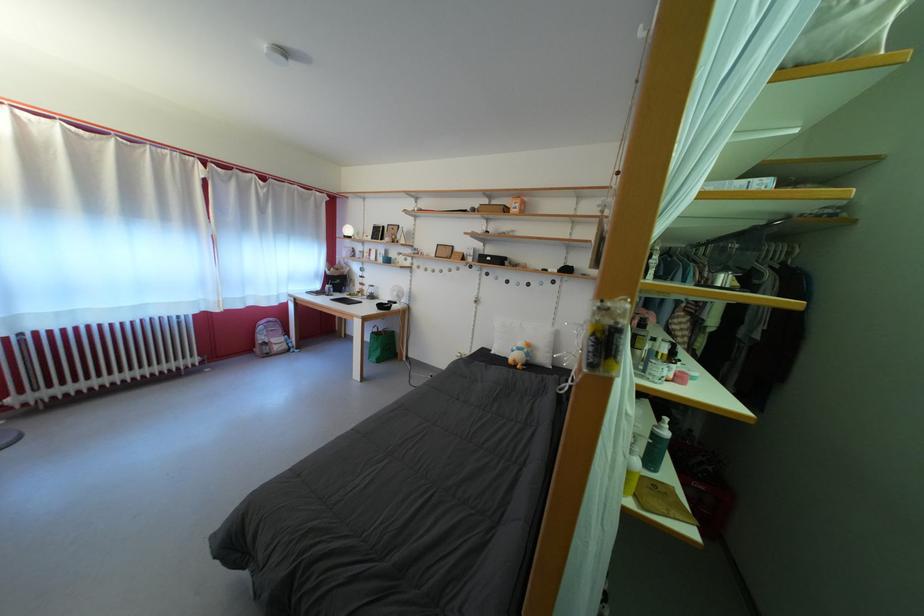
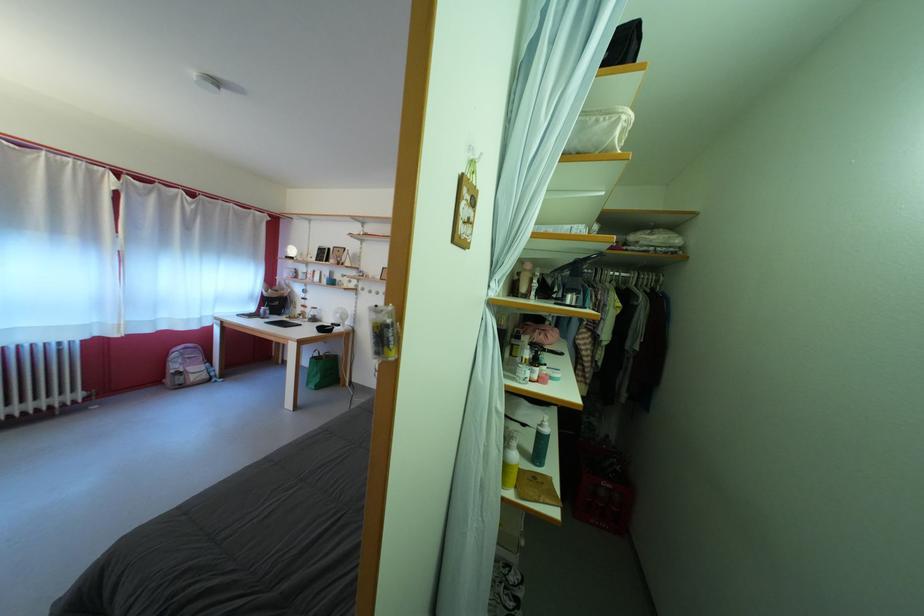
Find the pixel in the second image that matches point 605,345 in the first image.

(383, 339)